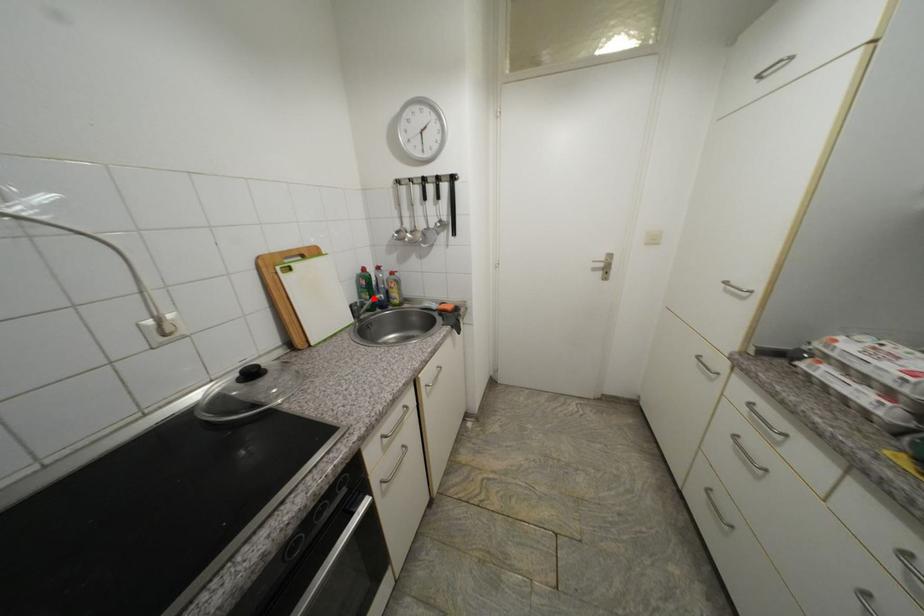
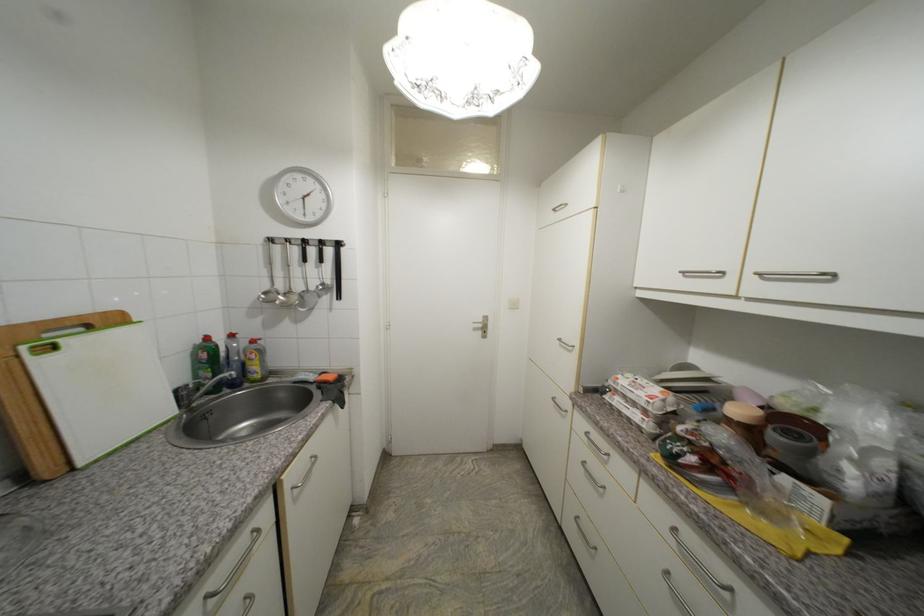
The point at the highlighted location is marked in the first image. Where is the corresponding point in the second image?

(215, 377)